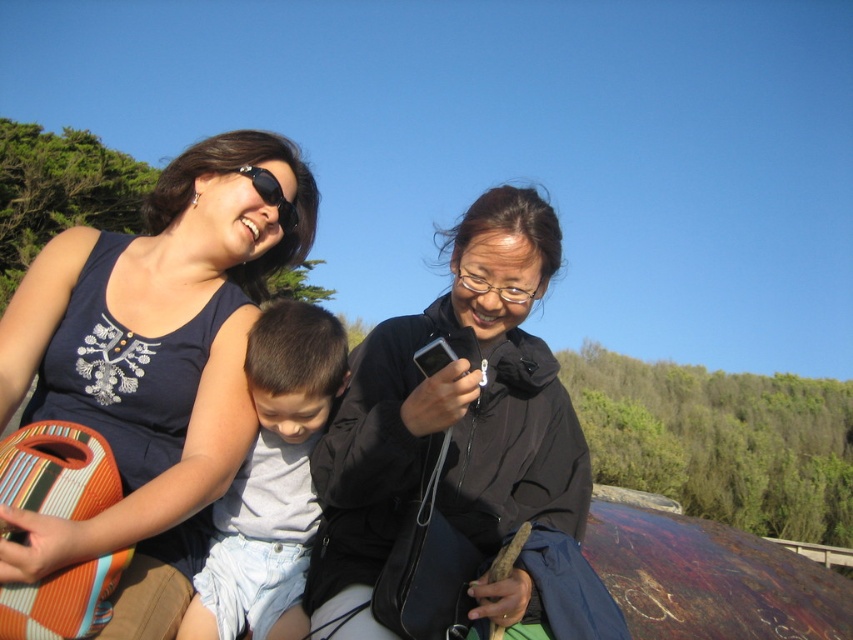
Is point (221, 273) closer to camera compared to point (193, 616)?

No, it is not.

This screenshot has height=640, width=853. I want to click on matte black tank top at upper left, so click(152, 365).

Where is `black matte jacket at center`? The height and width of the screenshot is (640, 853). black matte jacket at center is located at coordinates (450, 417).

Is black matte jacket at center taller than light blue denim shorts at center?

Correct, black matte jacket at center is much taller as light blue denim shorts at center.

Is point (531, 618) closer to camera compared to point (334, 337)?

Yes, it is in front of point (334, 337).

Image resolution: width=853 pixels, height=640 pixels. In order to click on black matte jacket at center in this screenshot , I will do `click(450, 417)`.

Does light blue denim shorts at center have a larger size compared to black matte sunglasses at upper center?

Yes.

How far apart are light blue denim shorts at center and black matte sunglasses at upper center?

A distance of 36.88 inches exists between light blue denim shorts at center and black matte sunglasses at upper center.

Which is in front, point (283, 481) or point (268, 196)?

Point (283, 481)

Image resolution: width=853 pixels, height=640 pixels. What are the coordinates of `light blue denim shorts at center` in the screenshot? It's located at (271, 481).